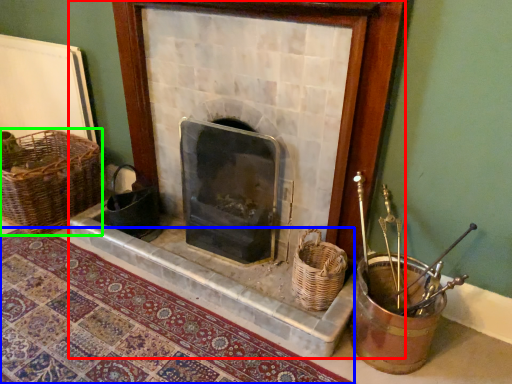
Question: Which object is the farthest from fireplace (highlighted by a red box)? Choose among these: mat (highlighted by a blue box) or basket (highlighted by a green box).

Choices:
 (A) mat
 (B) basket

Answer: (B)